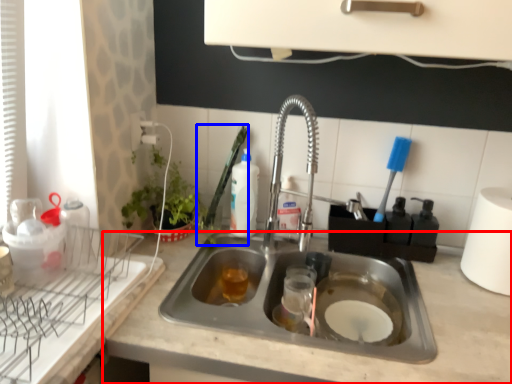
Question: Which object appears closest to the camera in this image, countertop (highlighted by a red box) or brush (highlighted by a blue box)?

Choices:
 (A) countertop
 (B) brush

Answer: (A)